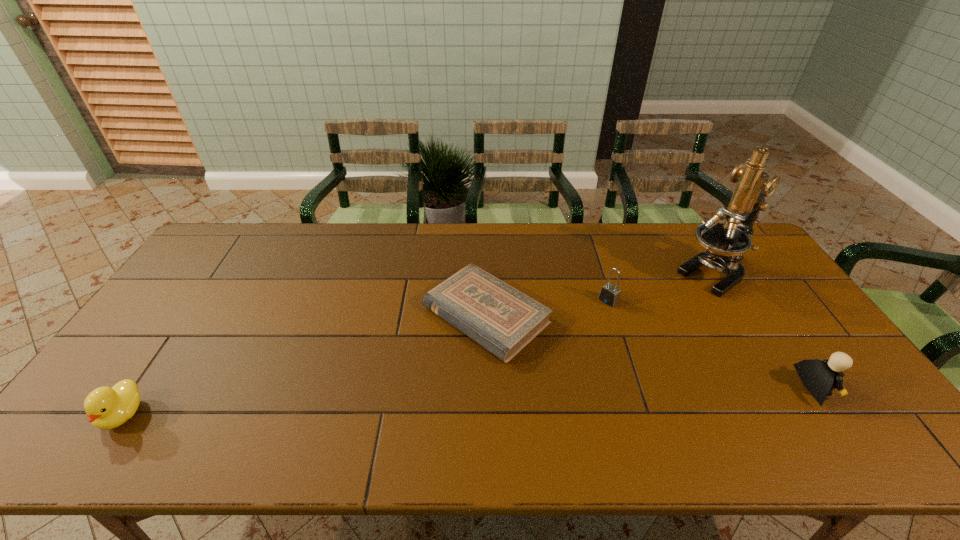
Where is `object that can be found as the third closest to the third object from right to left`? object that can be found as the third closest to the third object from right to left is located at coordinates (819, 377).

The height and width of the screenshot is (540, 960). Find the location of `vacant area in the image that satisfies the following two spatial constraints: 1. on the front side of the Bible; 2. on the front-facing side of the Lego`. vacant area in the image that satisfies the following two spatial constraints: 1. on the front side of the Bible; 2. on the front-facing side of the Lego is located at coordinates (487, 388).

Identify the location of free space that satisfies the following two spatial constraints: 1. on the back side of the third object from right to left; 2. on the right side of the Bible. (486, 301).